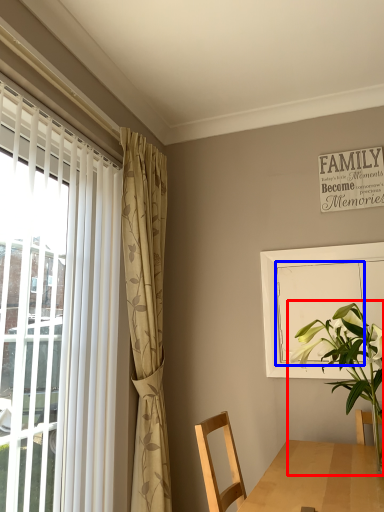
Question: Which object is further to the camera taking this photo, houseplant (highlighted by a red box) or screen door (highlighted by a blue box)?

Choices:
 (A) houseplant
 (B) screen door

Answer: (B)